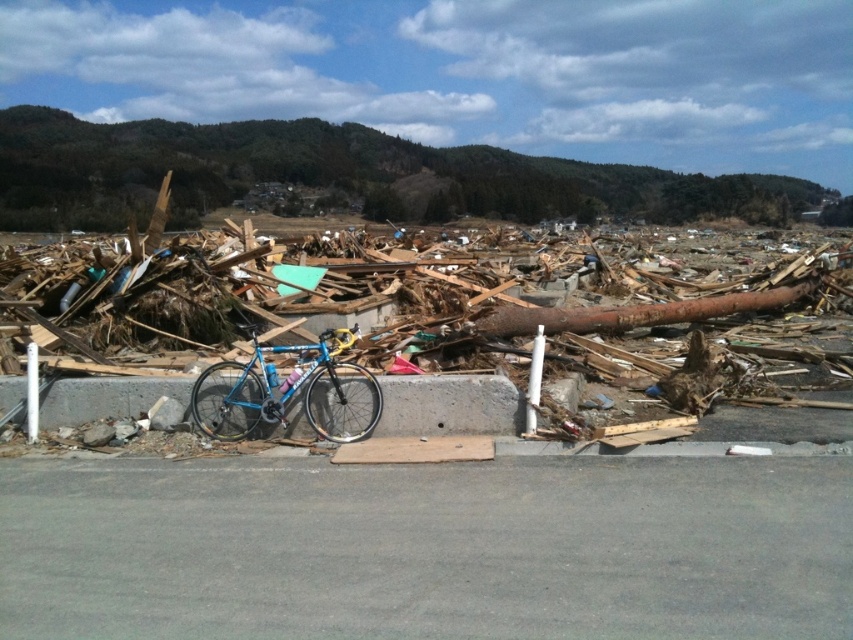
You are a rescue worker assessing the disaster area. You see the concrete at center and the shiny blue frame bicycle at center. Which object is taller?

The shiny blue frame bicycle at center is taller than the concrete at center.

You are a rescue worker trying to navigate through the disaster area. You see the concrete at center in front of you. Can you step over it?

The concrete at center is located at point (450, 404), which indicates its position but does not provide information about its height. Without knowing the height, it is impossible to determine if you can step over it. You should assess the concrete at center physically before attempting to navigate around it.

You are a rescue worker assessing the disaster area. You see the shiny blue frame bicycle at center and the rusty metal log at center. Which object is taller?

The shiny blue frame bicycle at center is taller than the rusty metal log at center.